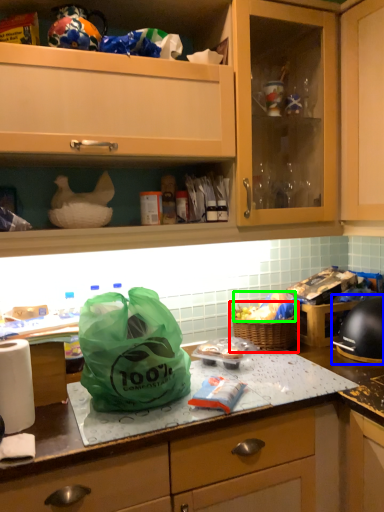
Question: Which object is positioned closest to picnic basket (highlighted by a red box)? Select from home appliance (highlighted by a blue box) and food (highlighted by a green box).

Choices:
 (A) home appliance
 (B) food

Answer: (B)